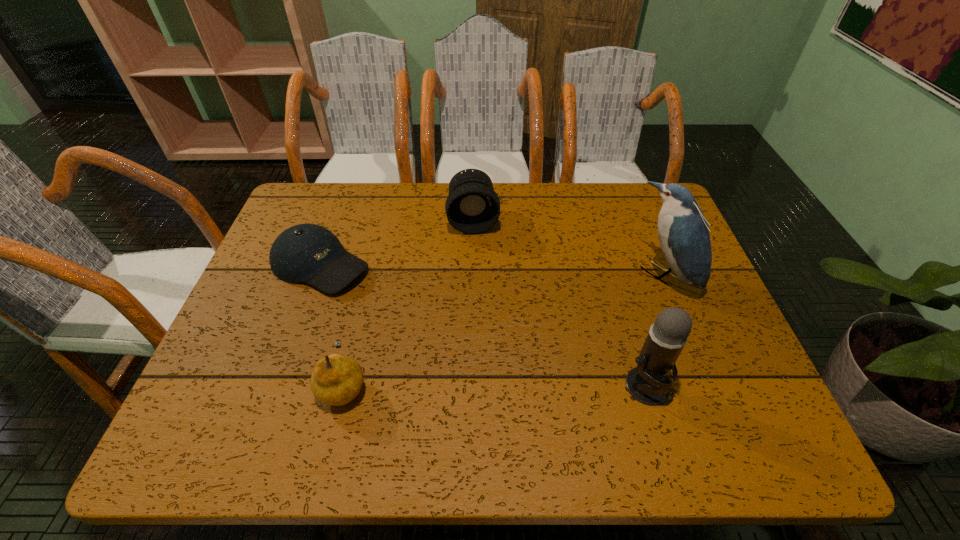
The width and height of the screenshot is (960, 540). Identify the location of object located at the right edge. (683, 232).

What are the coordinates of `blank space at the far edge of the desktop` in the screenshot? It's located at (564, 221).

The width and height of the screenshot is (960, 540). In order to click on vacant space at the left edge in this screenshot , I will do `click(264, 310)`.

Find the location of a particular element. free spot between the fourth object from left to right and the second shortest object is located at coordinates (495, 384).

Image resolution: width=960 pixels, height=540 pixels. I want to click on free space between the pear and the microphone, so click(495, 384).

The height and width of the screenshot is (540, 960). I want to click on free point between the baseball cap and the third object from left to right, so click(x=396, y=242).

At what (x,y) coordinates should I click in order to perform the action: click on free space between the telephoto lens and the fourth object from left to right. Please return your answer as a coordinate pair (x, y). The image size is (960, 540). Looking at the image, I should click on (560, 303).

This screenshot has width=960, height=540. Identify the location of free space between the shortest object and the rightmost object. (492, 270).

Image resolution: width=960 pixels, height=540 pixels. Find the location of `free spot between the shortest object and the microphone`. free spot between the shortest object and the microphone is located at coordinates (483, 325).

Identify the location of free point between the baseball cap and the third object from right to left. (396, 242).